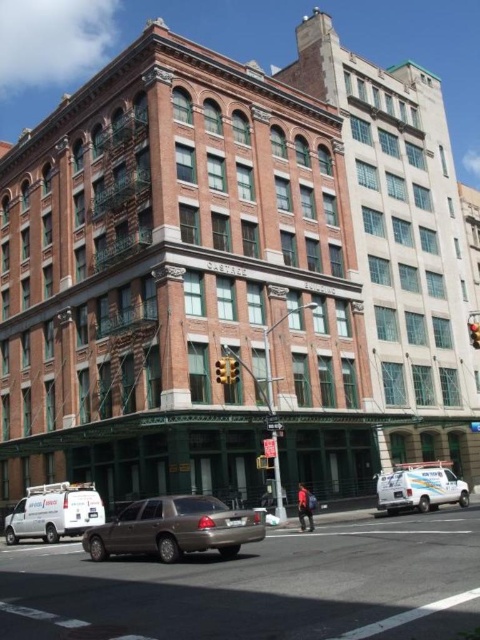
Question: Which of the following is the closest to the observer?

Choices:
 (A) (264, 467)
 (B) (220, 371)
 (C) (382, 493)

Answer: (B)

Question: Which object is closer to the camera taking this photo?

Choices:
 (A) white matte van at lower right
 (B) metallic traffic light at center

Answer: (B)

Question: Observing the image, what is the correct spatial positioning of brown matte sedan at lower center in reference to red glass traffic light at upper right?

Choices:
 (A) below
 (B) above

Answer: (A)

Question: Does white matte van at lower right have a larger size compared to metallic traffic light at center?

Choices:
 (A) no
 (B) yes

Answer: (B)

Question: Can you confirm if metallic traffic light at center is positioned below metallic silver traffic light at center?

Choices:
 (A) yes
 (B) no

Answer: (B)

Question: Which object appears farthest from the camera in this image?

Choices:
 (A) red glass traffic light at upper right
 (B) gold metallic sedan at lower center

Answer: (A)